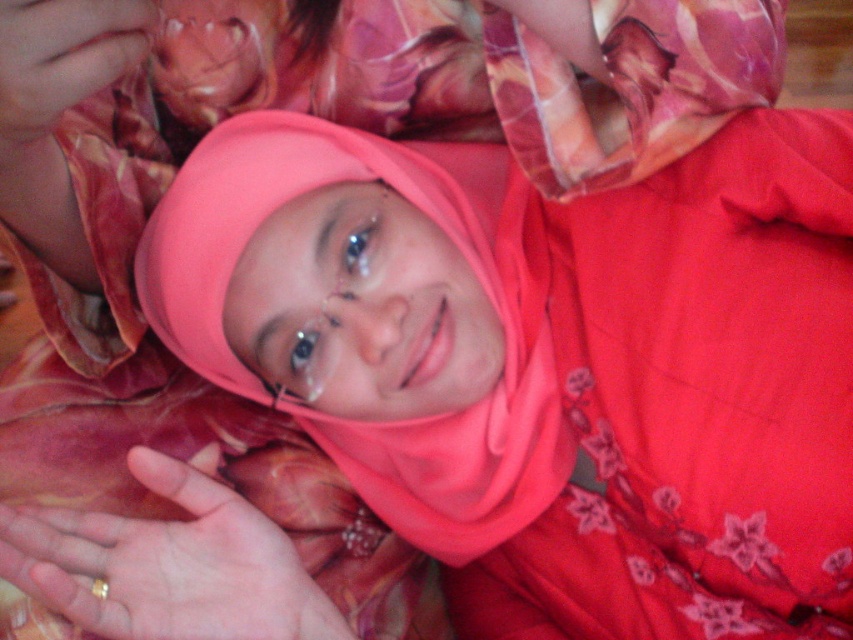
You are a photographer adjusting the focus on your camera. You want to ensure both the pink floral scarf at upper center and the pink fabric at upper left are in focus. The camera requires the distance between the two objects to be less than 30 centimeters for both to be in focus simultaneously. Is this possible?

The pink floral scarf at upper center and pink fabric at upper left are 29.90 centimeters apart from each other, which is just under the 30 centimeter threshold. Therefore, yes, both objects can be in focus at the same time.

You are designing a fashion layout for a magazine and need to place the matte pink hijab at center and the pink floral scarf at upper center. Based on their sizes, which one should you feature more prominently in the layout?

The matte pink hijab at center is larger in size than the pink floral scarf at upper center, so it should be featured more prominently in the layout.

You are a photographer setting up a shoot. You have a pink floral scarf at upper center and a gold metallic ring at lower left in your composition. To ensure both elements are in focus, where should you position your camera focus point?

You should position the camera focus point on the pink floral scarf at upper center because it is located above the gold metallic ring at lower left, ensuring both elements are within the depth of field.